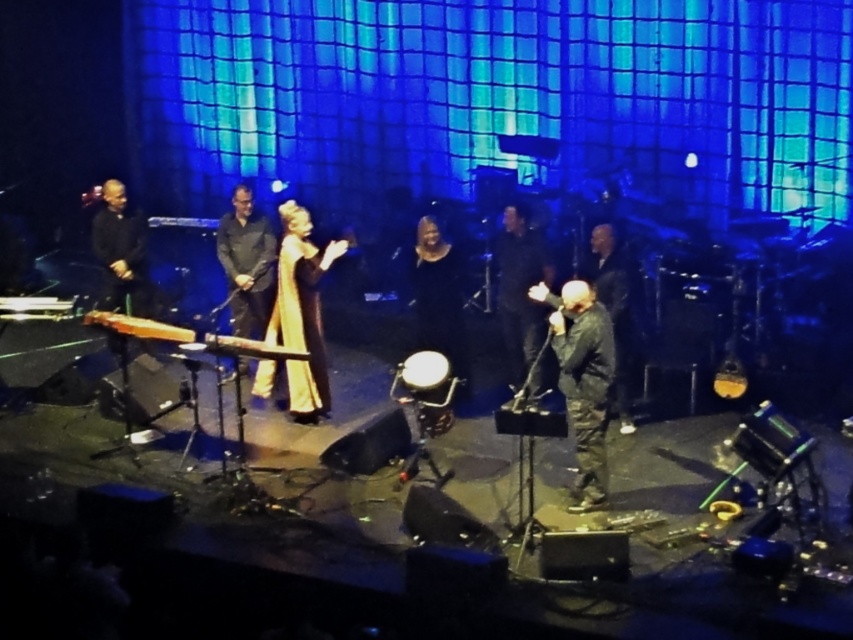
You are standing at the origin point of the stage coordinate system. The stage is represented as a 2D plane with coordinates ranging from 0 to 1 in both x and y axes. You need to move to the black matte suit at center. In which direction should you move? Please specify the direction as either north, south, east, or west based on the coordinate system where the positive y direction is north and positive x is east.

The black matte suit at center is located at coordinate point (x=520, y=289). Since the origin is at (x=0, y=0), moving towards this point would require moving east along the x axis to 0.453 and north along the y axis to 0.611. Therefore, the direction is northeast.

You are a photographer positioned at the camera. You need to capture a closeup shot of the gold silk dress at center. Given that your camera can focus on objects within 5 meters, will you be able to take the closeup?

The gold silk dress at center is 7.92 meters away from the camera, which is beyond the 5 meter focusing range. Therefore, you cannot take a closeup shot.